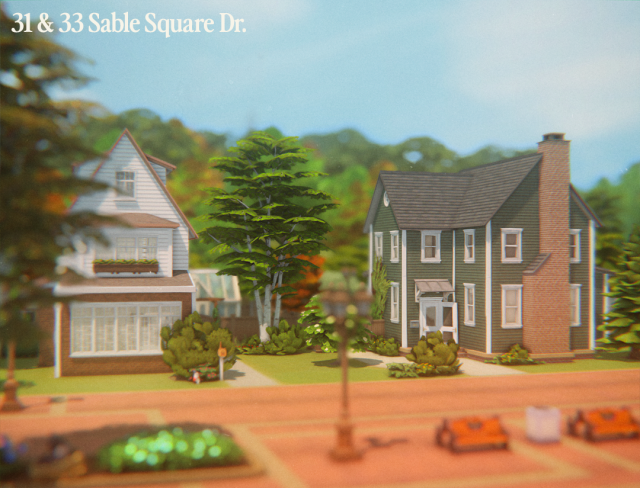
You are a GUI agent. You are given a task and a screenshot of the screen. Output one action in this format:
    pyautogui.click(x=<x>, y=<y>)
    Task: Click on the downstairs window
    
    Given the screenshot: What is the action you would take?
    pyautogui.click(x=83, y=331), pyautogui.click(x=108, y=325), pyautogui.click(x=129, y=326), pyautogui.click(x=148, y=330), pyautogui.click(x=164, y=324), pyautogui.click(x=468, y=299), pyautogui.click(x=509, y=300), pyautogui.click(x=569, y=303), pyautogui.click(x=393, y=306)